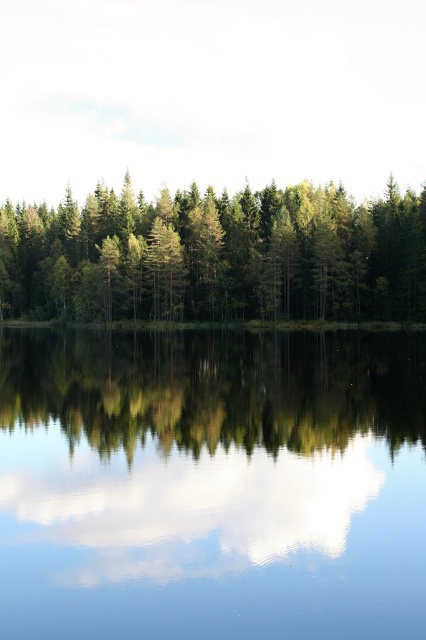
Question: Where is transparent glass water at center located in relation to green matte tree at center in the image?

Choices:
 (A) right
 (B) left

Answer: (A)

Question: Does transparent glass water at center have a larger size compared to green matte tree at center?

Choices:
 (A) yes
 (B) no

Answer: (B)

Question: Which object is farther from the camera taking this photo?

Choices:
 (A) transparent glass water at center
 (B) green matte tree at center

Answer: (B)

Question: Can you confirm if transparent glass water at center is wider than green matte tree at center?

Choices:
 (A) yes
 (B) no

Answer: (B)